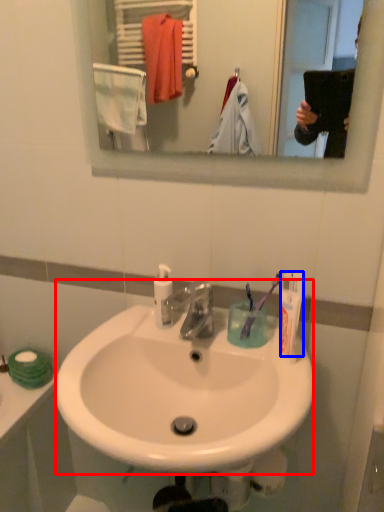
Question: Which of the following is the farthest to the observer, sink (highlighted by a red box) or toothpaste (highlighted by a blue box)?

Choices:
 (A) sink
 (B) toothpaste

Answer: (B)